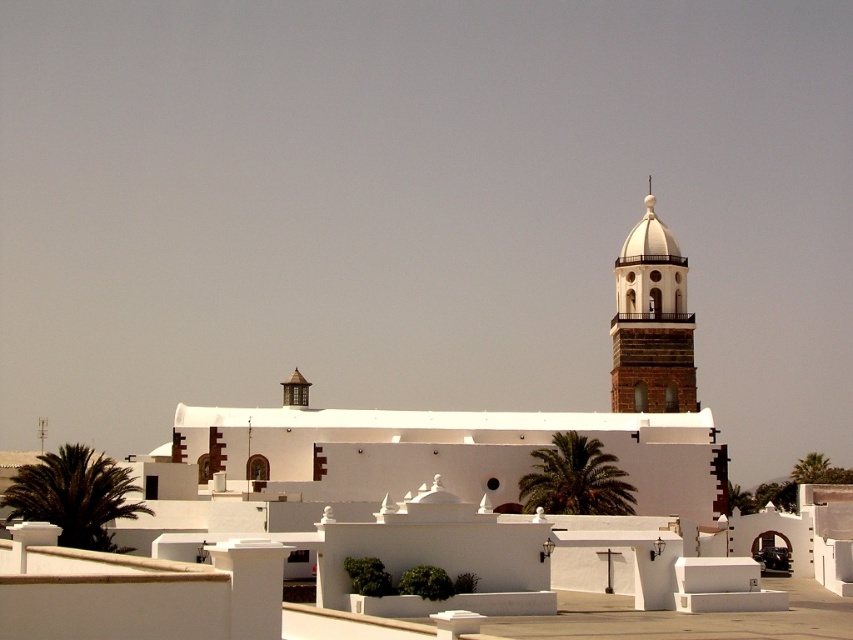
Based on the photo, you are standing in front of the large white building with a bell tower and see two green leafy palms. Which one is closer to you, the green leafy palm at lower left or the green leafy palm tree at center?

→ The green leafy palm at lower left is closer to the viewer than the green leafy palm tree at center.